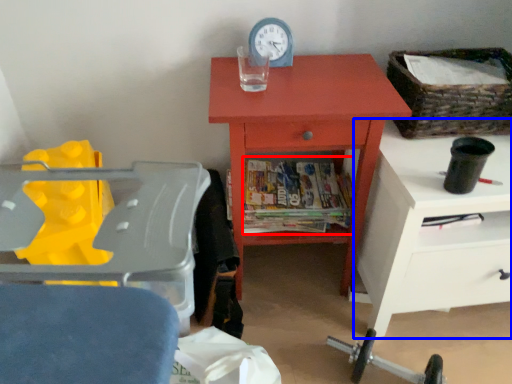
Question: Which of the following is the farthest to the observer, magazine (highlighted by a red box) or nightstand (highlighted by a blue box)?

Choices:
 (A) magazine
 (B) nightstand

Answer: (A)